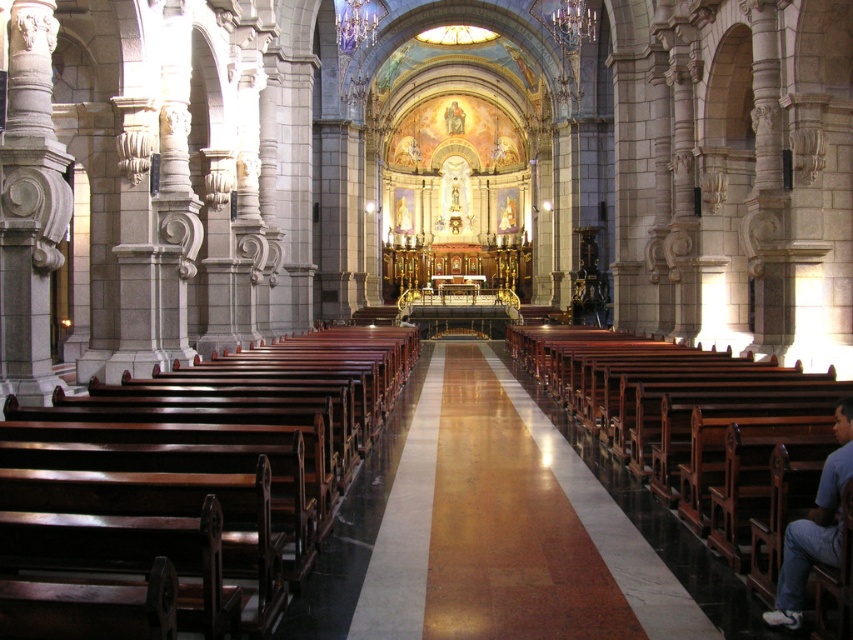
Question: Where is brown polished wood aisle at center located in relation to polished wood bench at center in the image?

Choices:
 (A) left
 (B) right

Answer: (A)

Question: Which object appears closest to the camera in this image?

Choices:
 (A) polished dark wood bench at center
 (B) brown polished wood aisle at center
 (C) blue cotton shirt at lower right
 (D) polished wood bench at center

Answer: (A)

Question: Which of the following is the farthest from the observer?

Choices:
 (A) (782, 580)
 (B) (822, 416)

Answer: (B)

Question: Is polished dark wood bench at center to the left of blue cotton shirt at lower right from the viewer's perspective?

Choices:
 (A) yes
 (B) no

Answer: (A)

Question: Is brown polished wood aisle at center above polished wood bench at center?

Choices:
 (A) yes
 (B) no

Answer: (B)

Question: Which point appears closest to the camera in this image?

Choices:
 (A) (405, 332)
 (B) (802, 518)

Answer: (B)